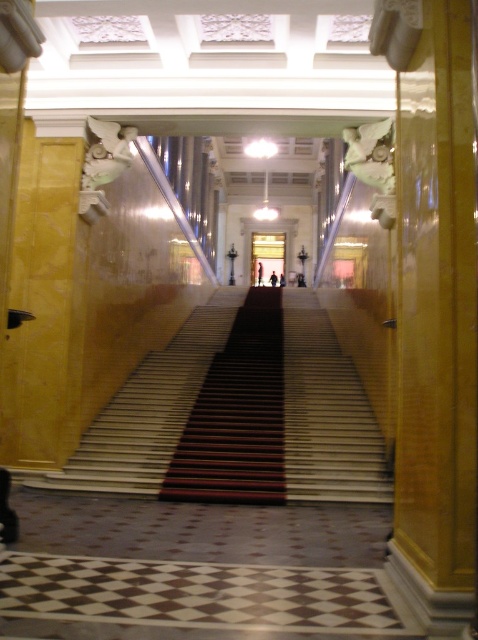
Question: Can you confirm if polished marble stairs at center is positioned to the left of wooden polished stairs at center?

Choices:
 (A) yes
 (B) no

Answer: (B)

Question: Which of the following is the closest to the observer?

Choices:
 (A) polished marble stairs at center
 (B) wooden polished stairs at center

Answer: (B)

Question: Can you confirm if polished marble stairs at center is positioned below wooden polished stairs at center?

Choices:
 (A) no
 (B) yes

Answer: (B)

Question: Where is polished marble stairs at center located in relation to wooden polished stairs at center in the image?

Choices:
 (A) above
 (B) below

Answer: (B)